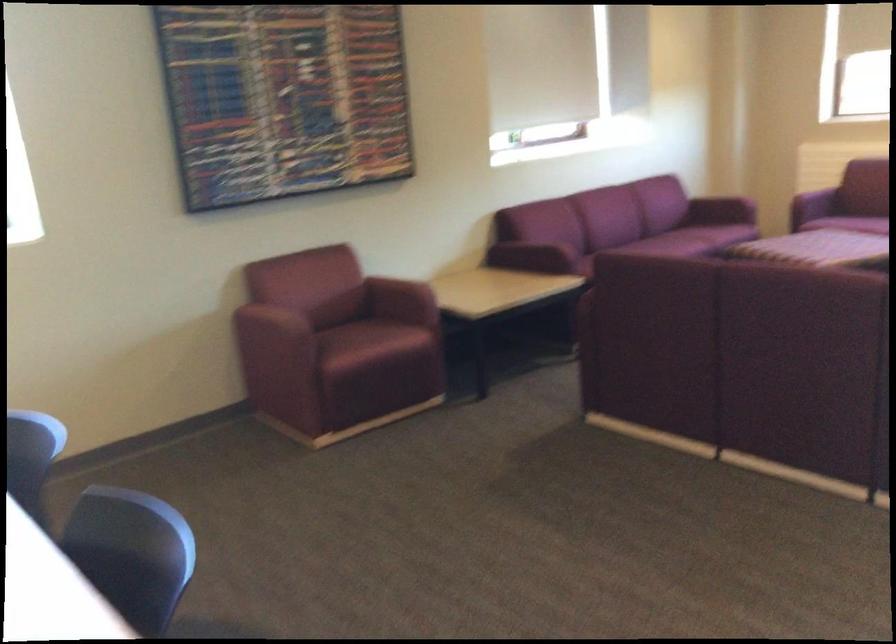
At what (x,y) coordinates should I click in order to perform the action: click on maroon sofa armrest. Please return your answer as a coordinate pair (x, y). The height and width of the screenshot is (644, 896). Looking at the image, I should click on (720, 211).